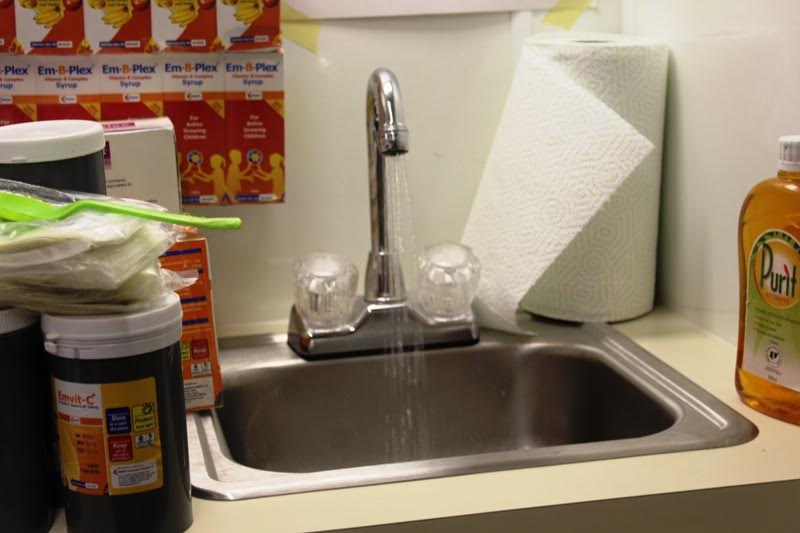
This screenshot has height=533, width=800. I want to click on paper towels, so click(x=578, y=161).